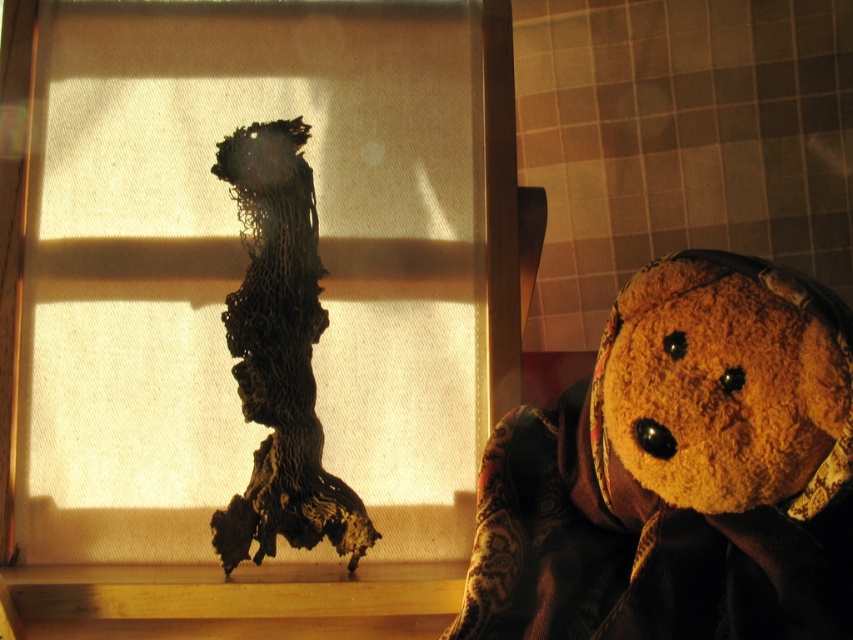
You are trying to place a new decorative pillow between the fuzzy brown teddy bear at right and the charcoal textured fabric at center. Based on their widths, will the pillow fit comfortably between them?

The fuzzy brown teddy bear at right might be wider than charcoal textured fabric at center, so the pillow may not fit comfortably between them if the space is too narrow.

You are standing in the room described in the scene. There is a point marked at coordinates (251, 280). What object is located at this point?

The point at coordinates (251, 280) marks the translucent fabric at center.

You are organizing a child birthday party and need to arrange the fuzzy brown teddy bear at right and the charcoal textured fabric at center in a way that follows the existing scene layout. Which object should be placed to the right of the other?

The fuzzy brown teddy bear at right should be placed to the right of the charcoal textured fabric at center because the fuzzy brown teddy bear at right is positioned on the right side of charcoal textured fabric at center in the original scene.